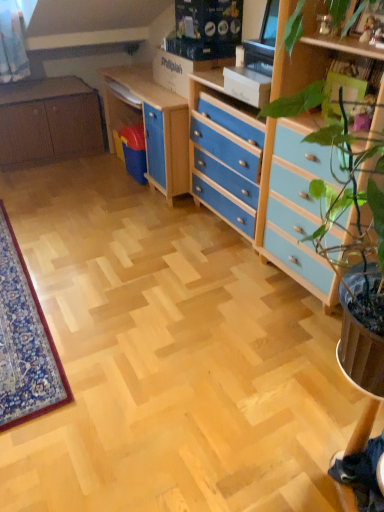
Question: Does matte brown cabinet at left turn towards blue painted wood chest of drawers at center right?

Choices:
 (A) yes
 (B) no

Answer: (A)

Question: From the image's perspective, does matte brown cabinet at left appear higher than blue painted wood chest of drawers at center right?

Choices:
 (A) no
 (B) yes

Answer: (B)

Question: Can you confirm if matte brown cabinet at left is shorter than blue painted wood chest of drawers at center right?

Choices:
 (A) yes
 (B) no

Answer: (A)

Question: From the image's perspective, is matte brown cabinet at left beneath blue painted wood chest of drawers at center right?

Choices:
 (A) no
 (B) yes

Answer: (A)

Question: Is matte brown cabinet at left thinner than blue painted wood chest of drawers at center right?

Choices:
 (A) no
 (B) yes

Answer: (A)

Question: Does matte brown cabinet at left have a greater width compared to blue painted wood chest of drawers at center right?

Choices:
 (A) yes
 (B) no

Answer: (A)

Question: Is blue painted wood chest of drawers at center right surrounding matte wood computer desk at center?

Choices:
 (A) yes
 (B) no

Answer: (B)

Question: Considering the relative sizes of blue painted wood chest of drawers at center right and matte wood computer desk at center in the image provided, is blue painted wood chest of drawers at center right smaller than matte wood computer desk at center?

Choices:
 (A) no
 (B) yes

Answer: (A)

Question: Considering the relative sizes of blue painted wood chest of drawers at center right and matte wood computer desk at center in the image provided, is blue painted wood chest of drawers at center right wider than matte wood computer desk at center?

Choices:
 (A) yes
 (B) no

Answer: (A)

Question: From the image's perspective, is blue painted wood chest of drawers at center right located above matte wood computer desk at center?

Choices:
 (A) no
 (B) yes

Answer: (B)

Question: Is blue painted wood chest of drawers at center right touching matte wood computer desk at center?

Choices:
 (A) yes
 (B) no

Answer: (B)

Question: From a real-world perspective, does blue painted wood chest of drawers at center right sit lower than matte wood computer desk at center?

Choices:
 (A) no
 (B) yes

Answer: (A)

Question: Can you confirm if matte brown cabinet at left is smaller than matte wood computer desk at center?

Choices:
 (A) yes
 (B) no

Answer: (B)